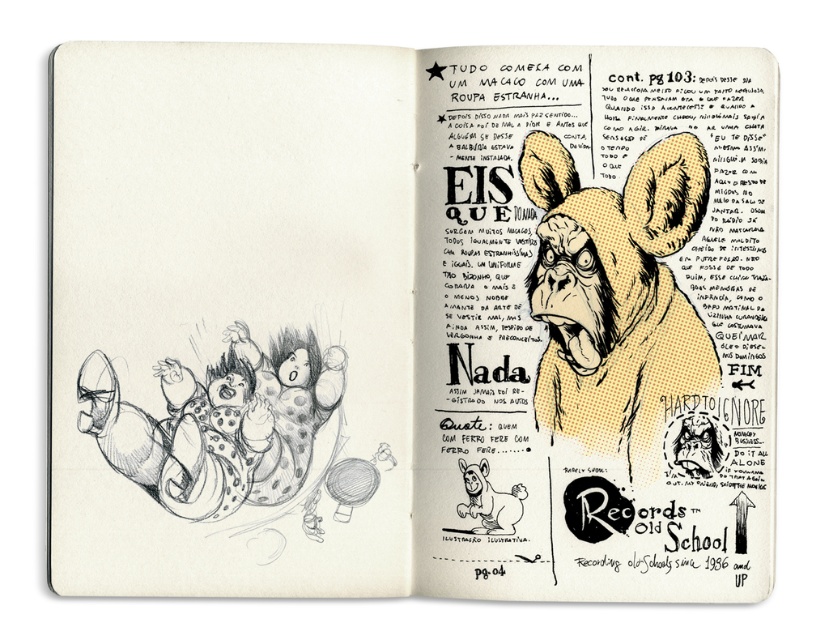
Consider the image. You are an artist trying to locate the yellow dotted fabric monkey at upper right in your sketchbook. Based on the coordinates provided, can you determine its exact location on the page?

The yellow dotted fabric monkey at upper right is located at coordinates point (616, 298) on the page.

You are an artist trying to decide where to add a new character to the sketchbook. You have two options on the current pages. The yellow dotted fabric monkey at upper right and the black and white sketch of children at left. Which existing character is bigger and would allow more space for your new character?

The black and white sketch of children at left is larger than the yellow dotted fabric monkey at upper right, so adding a new character next to it would provide more space.

You are an art student analyzing the sketchbook. You notice the yellow dotted fabric monkey at upper right and the black and white sketch of children at left. Which object is closer to you?

The yellow dotted fabric monkey at upper right is closer to you because it is further to the viewer than the black and white sketch of children at left.